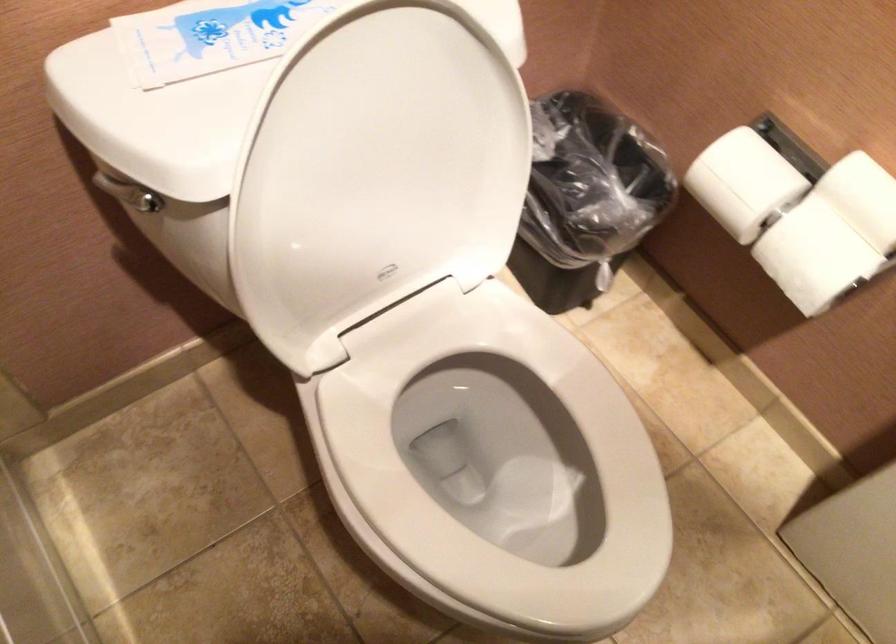
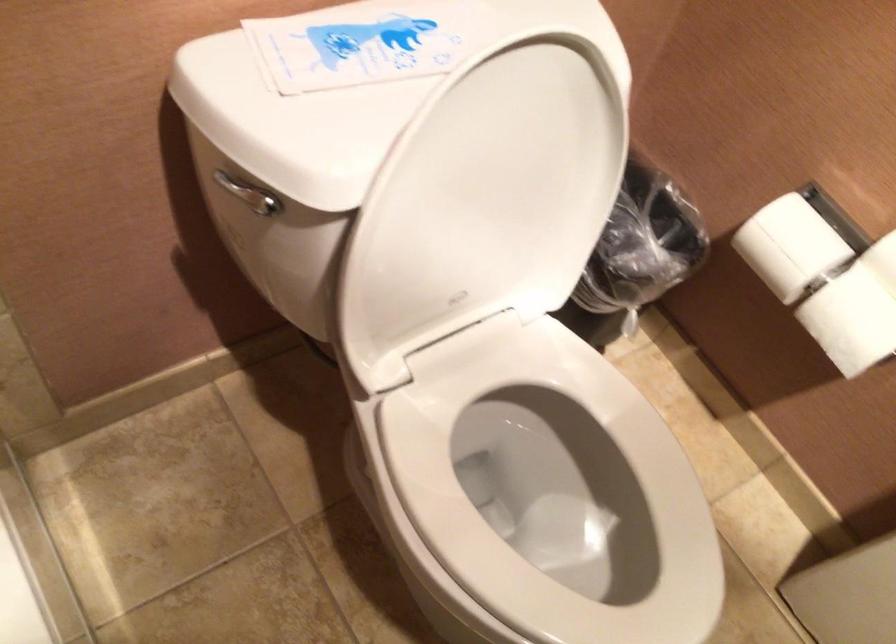
Question: The camera is either moving clockwise (left) or counter-clockwise (right) around the object. The first image is from the beginning of the video and the second image is from the end. Is the camera moving left or right when shooting the video?

Choices:
 (A) Left
 (B) Right

Answer: (A)